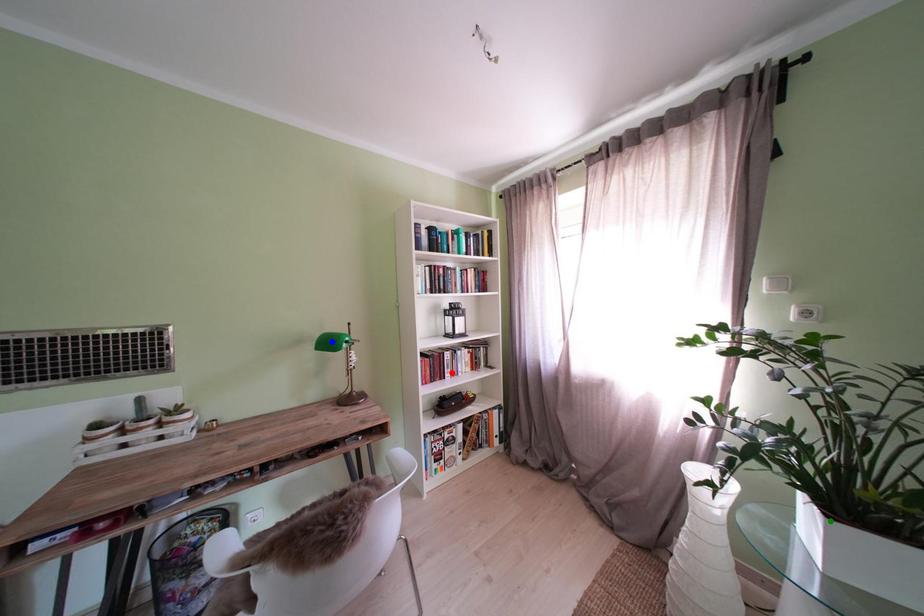
Order these from nearest to farthest:
A) blue point
B) green point
C) red point

green point → blue point → red point